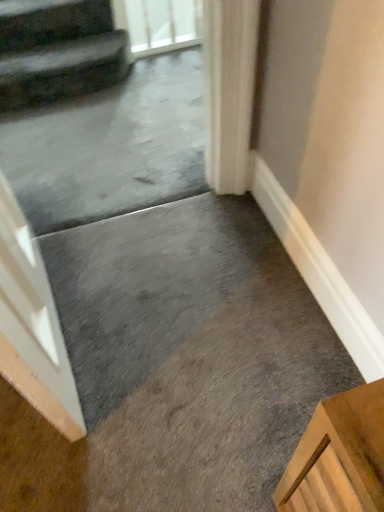
Question: Is dark gray plush stairs at upper left to the left or to the right of clear glass screen door at upper center in the image?

Choices:
 (A) right
 (B) left

Answer: (B)

Question: From the image's perspective, relative to clear glass screen door at upper center, is dark gray plush stairs at upper left above or below?

Choices:
 (A) above
 (B) below

Answer: (B)

Question: Considering the positions of dark gray plush stairs at upper left and clear glass screen door at upper center in the image, is dark gray plush stairs at upper left taller or shorter than clear glass screen door at upper center?

Choices:
 (A) tall
 (B) short

Answer: (B)

Question: Considering the relative positions of clear glass screen door at upper center and dark gray plush stairs at upper left in the image provided, is clear glass screen door at upper center to the left or to the right of dark gray plush stairs at upper left?

Choices:
 (A) right
 (B) left

Answer: (A)

Question: Is clear glass screen door at upper center bigger or smaller than dark gray plush stairs at upper left?

Choices:
 (A) big
 (B) small

Answer: (B)

Question: Is point (168, 46) closer or farther from the camera than point (3, 37)?

Choices:
 (A) closer
 (B) farther

Answer: (B)

Question: From their relative heights in the image, would you say clear glass screen door at upper center is taller or shorter than dark gray plush stairs at upper left?

Choices:
 (A) short
 (B) tall

Answer: (B)